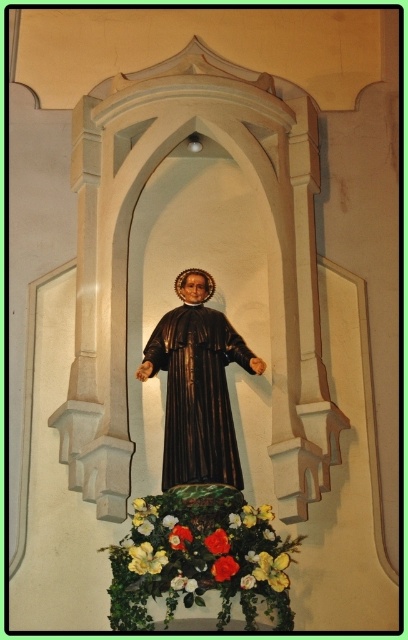
You are an art conservator examining the religious statue and flower arrangement in the alcove. You need to determine the spatial relationship between the shiny dark brown statue at center and the yellow matte flower at lower center. Which object is positioned closer to the viewer?

The shiny dark brown statue at center is closer to the viewer than the yellow matte flower at lower center because the flower is described as being behind the statue.

You are a photographer standing at a certain distance from the religious statue. You want to capture a closeup shot of the vivid red petals at center. Based on the scene description, what is the minimum distance you need to move closer to the statue to ensure the petals fill the frame?

The vivid red petals at center are 52.74 meters away from the camera. To capture a closeup, you need to move closer so that the distance is reduced to within the camera lens focus range. However, the exact minimum distance depends on the camera equipment used.